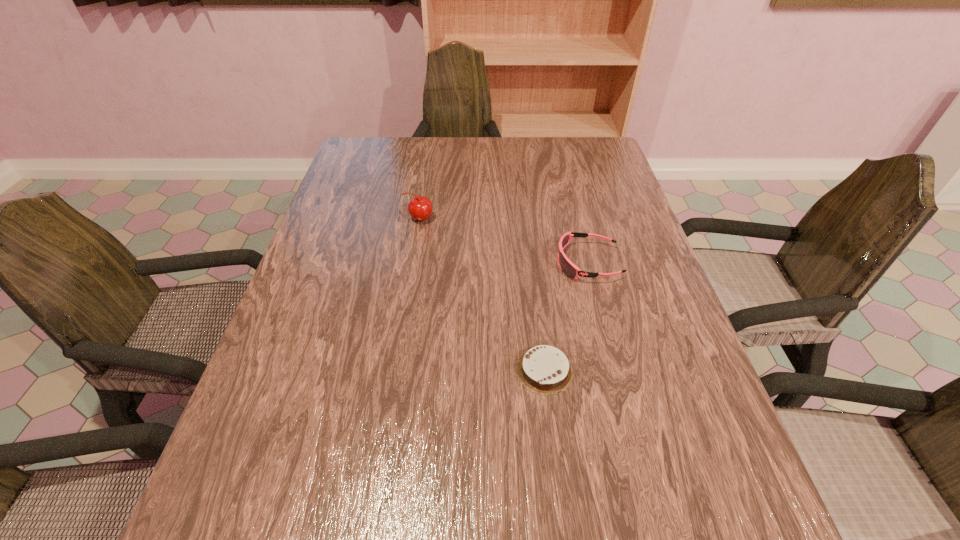
This screenshot has width=960, height=540. Find the location of `free space between the goggles and the chocolate cake`. free space between the goggles and the chocolate cake is located at coordinates (566, 316).

Where is `vacant area between the shortest object and the tallest object`? vacant area between the shortest object and the tallest object is located at coordinates (482, 294).

The image size is (960, 540). Find the location of `free space between the second shortest object and the leftmost object`. free space between the second shortest object and the leftmost object is located at coordinates (503, 241).

Identify the location of free area in between the tallest object and the nearest object. (482, 294).

You are a GUI agent. You are given a task and a screenshot of the screen. Output one action in this format:
    pyautogui.click(x=<x>, y=<y>)
    Task: Click on the free space between the goggles and the second object from left to right
    The width and height of the screenshot is (960, 540).
    Given the screenshot: What is the action you would take?
    pyautogui.click(x=566, y=316)

Find the location of a particular element. The height and width of the screenshot is (540, 960). object that can be found as the second closest to the shortest object is located at coordinates (420, 208).

You are a GUI agent. You are given a task and a screenshot of the screen. Output one action in this format:
    pyautogui.click(x=<x>, y=<y>)
    Task: Click on the closest object to the second object from right to left
    The height and width of the screenshot is (540, 960).
    Given the screenshot: What is the action you would take?
    click(x=568, y=268)

Identify the location of vacant region that satisfies the following two spatial constraints: 1. on the front-facing side of the second farthest object; 2. on the front side of the shortest object. This screenshot has height=540, width=960. (615, 370).